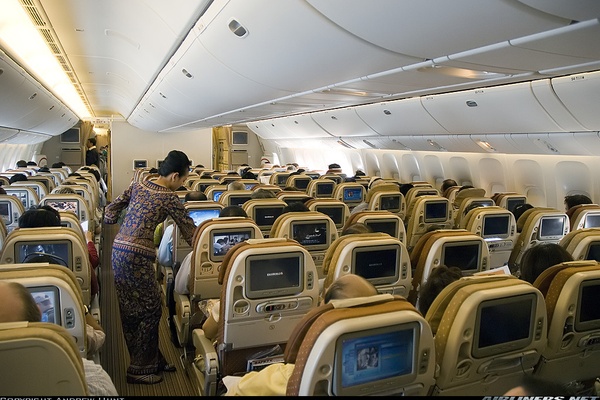
Find the location of a particular element. This screenshot has height=400, width=600. windows is located at coordinates (x=378, y=169), (x=425, y=178), (x=460, y=180), (x=504, y=192), (x=565, y=192), (x=12, y=168), (x=1, y=170).